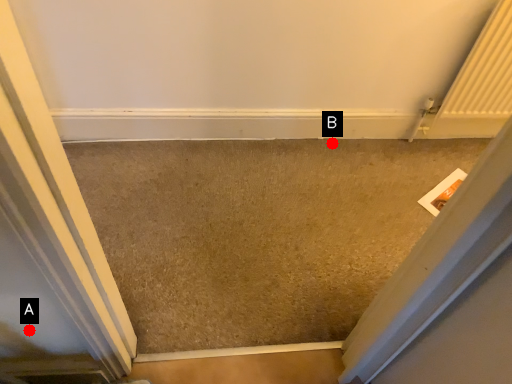
Question: Two points are circled on the image, labeled by A and B beside each circle. Which point is closer to the camera taking this photo?

Choices:
 (A) A is closer
 (B) B is closer

Answer: (A)